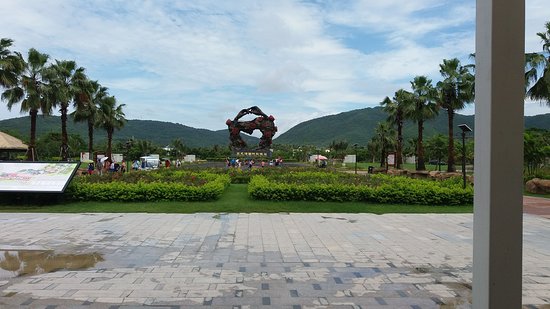
At what (x,y) coordinates should I click in order to perform the action: click on rust-colored art sculpture. Please return your answer as a coordinate pair (x, y). Looking at the image, I should click on (252, 127).